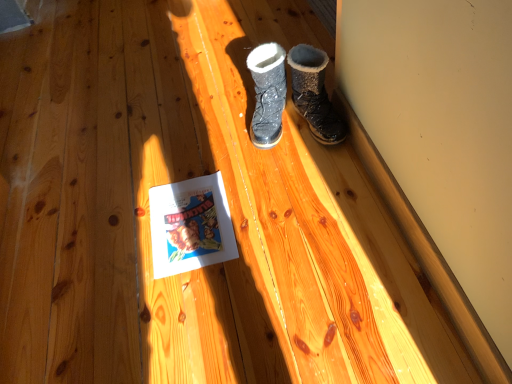
Question: Is sparkly black boot at center, the first footwear from the left, shorter than dark brown suede boot at upper right, which appears as the first footwear when viewed from the right?

Choices:
 (A) no
 (B) yes

Answer: (B)

Question: From the image's perspective, is sparkly black boot at center, the first footwear from the left, on top of dark brown suede boot at upper right, which appears as the first footwear when viewed from the right?

Choices:
 (A) yes
 (B) no

Answer: (B)

Question: Can you confirm if sparkly black boot at center, the first footwear from the left, is taller than dark brown suede boot at upper right, which appears as the first footwear when viewed from the right?

Choices:
 (A) yes
 (B) no

Answer: (B)

Question: Is sparkly black boot at center, the first footwear from the left, positioned behind dark brown suede boot at upper right, which appears as the first footwear when viewed from the right?

Choices:
 (A) no
 (B) yes

Answer: (B)

Question: Is sparkly black boot at center, which is the second footwear in right-to-left order, not close to dark brown suede boot at upper right, which appears as the first footwear when viewed from the right?

Choices:
 (A) no
 (B) yes

Answer: (A)

Question: From the image's perspective, is sparkly black boot at center, the first footwear from the left, below dark brown suede boot at upper right, which appears as the first footwear when viewed from the right?

Choices:
 (A) yes
 (B) no

Answer: (A)

Question: From the image's perspective, does dark brown suede boot at upper right, which ranks as the 2th footwear in left-to-right order, appear higher than sparkly black boot at center, which is the second footwear in right-to-left order?

Choices:
 (A) yes
 (B) no

Answer: (A)

Question: Is dark brown suede boot at upper right, which ranks as the 2th footwear in left-to-right order, outside of sparkly black boot at center, the first footwear from the left?

Choices:
 (A) no
 (B) yes

Answer: (B)

Question: Does dark brown suede boot at upper right, which ranks as the 2th footwear in left-to-right order, have a larger size compared to sparkly black boot at center, which is the second footwear in right-to-left order?

Choices:
 (A) yes
 (B) no

Answer: (A)

Question: Does dark brown suede boot at upper right, which appears as the first footwear when viewed from the right, have a lesser width compared to sparkly black boot at center, the first footwear from the left?

Choices:
 (A) no
 (B) yes

Answer: (B)

Question: Is dark brown suede boot at upper right, which ranks as the 2th footwear in left-to-right order, positioned before sparkly black boot at center, which is the second footwear in right-to-left order?

Choices:
 (A) no
 (B) yes

Answer: (B)

Question: Can you confirm if dark brown suede boot at upper right, which appears as the first footwear when viewed from the right, is taller than sparkly black boot at center, which is the second footwear in right-to-left order?

Choices:
 (A) yes
 (B) no

Answer: (A)

Question: From the image's perspective, is white paper at center on dark brown suede boot at upper right, which appears as the first footwear when viewed from the right?

Choices:
 (A) yes
 (B) no

Answer: (B)